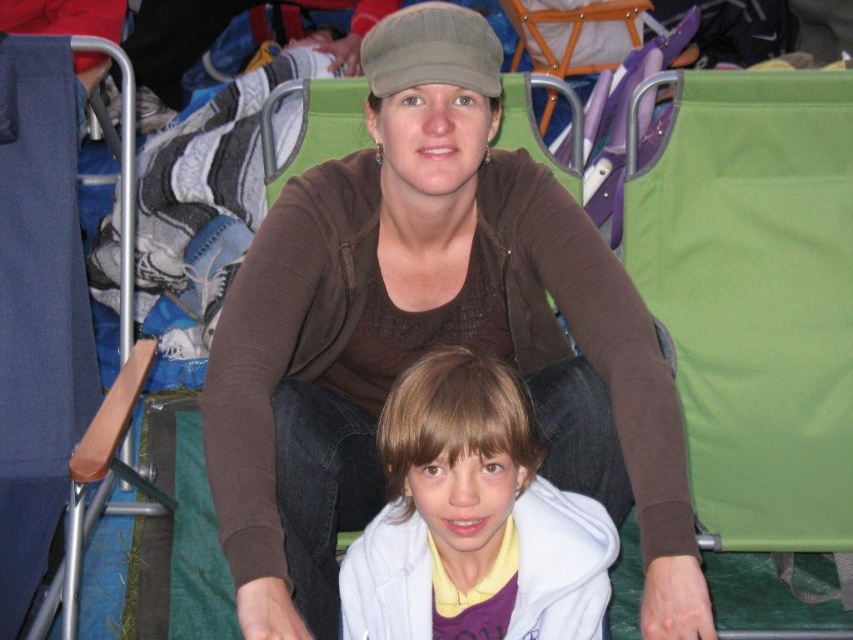
Question: Is brown fabric sweater at center to the right of white fleece jacket at center from the viewer's perspective?

Choices:
 (A) yes
 (B) no

Answer: (B)

Question: Which object is closer to the camera taking this photo?

Choices:
 (A) white fleece jacket at center
 (B) brown fabric sweater at center

Answer: (B)

Question: Observing the image, what is the correct spatial positioning of brown fabric sweater at center in reference to white fleece jacket at center?

Choices:
 (A) right
 (B) left

Answer: (B)

Question: Which of the following is the closest to the observer?

Choices:
 (A) white fleece jacket at center
 (B) brown fabric sweater at center

Answer: (B)

Question: Is brown fabric sweater at center closer to the viewer compared to white fleece jacket at center?

Choices:
 (A) yes
 (B) no

Answer: (A)